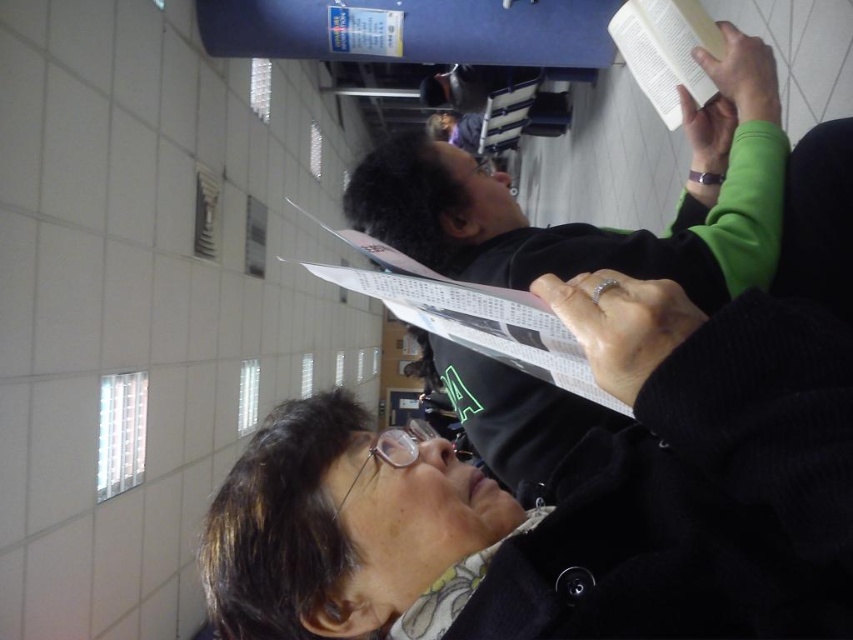
You are standing in the rotated image scene and want to move towards the two points marked as point (625,516) and point (401,177). Which point should you walk towards first if you want to reach the one closer to you?

You should walk towards point (625,516) first because it is closer to you than point (401,177).

You are organizing a bookshelf and need to place both the black matte book at upper center and the white paper book at upper right. Given their sizes, which book should you place on the lower shelf to ensure stability?

The black matte book at upper center is much taller than the white paper book at upper right, so placing the taller book on the lower shelf would provide better stability.